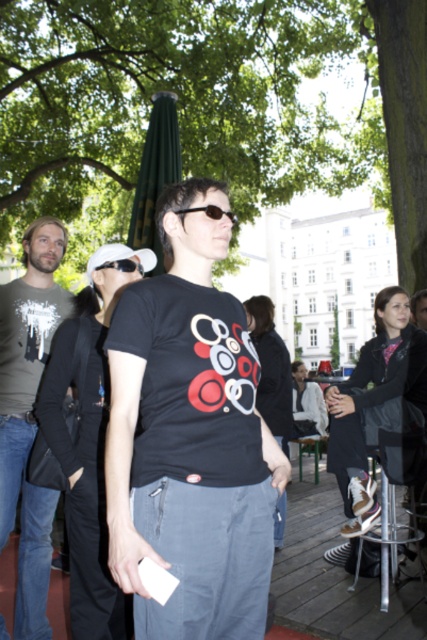
Question: Among these objects, which one is nearest to the camera?

Choices:
 (A) black matte t-shirt at center
 (B) black plastic sunglasses at center

Answer: (A)

Question: Can you confirm if black plastic sunglasses at center is bigger than black plastic goggles at upper center?

Choices:
 (A) no
 (B) yes

Answer: (A)

Question: Among these objects, which one is farthest from the camera?

Choices:
 (A) black plastic sunglasses at center
 (B) black plastic goggles at upper center

Answer: (B)

Question: Estimate the real-world distances between objects in this image. Which object is farther from the gray cotton t-shirt at left?

Choices:
 (A) black plastic goggles at upper center
 (B) black plastic sunglasses at center

Answer: (B)

Question: Considering the relative positions of gray cotton t-shirt at left and black plastic goggles at upper center in the image provided, where is gray cotton t-shirt at left located with respect to black plastic goggles at upper center?

Choices:
 (A) below
 (B) above

Answer: (A)

Question: Can you confirm if black matte t-shirt at center is positioned below black plastic goggles at upper center?

Choices:
 (A) yes
 (B) no

Answer: (A)